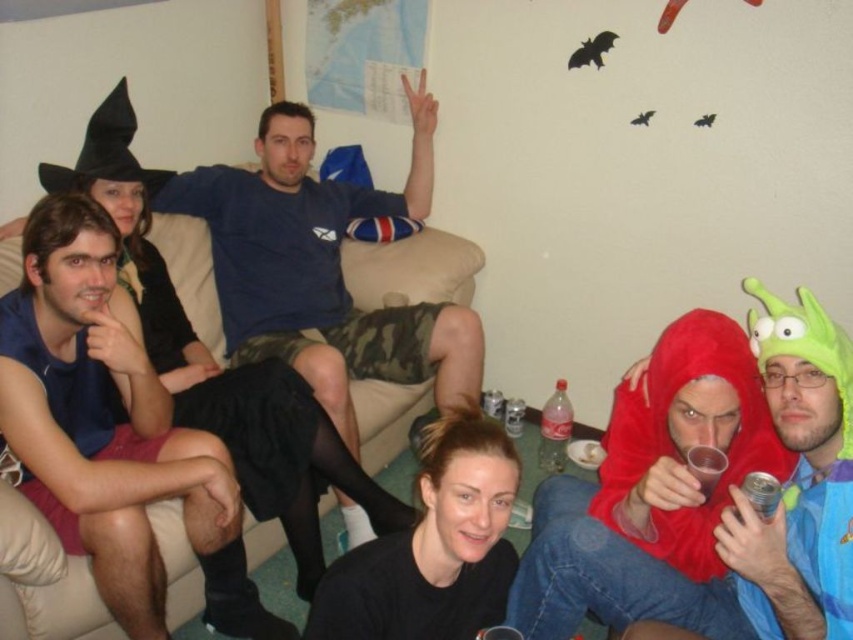
You are at a party and want to grab a drink. You see a metallic silver can at lower right and a translucent plastic cup at lower right. Which one is closer to you?

The metallic silver can at lower right is positioned under the translucent plastic cup at lower right, so the cup is closer to you.